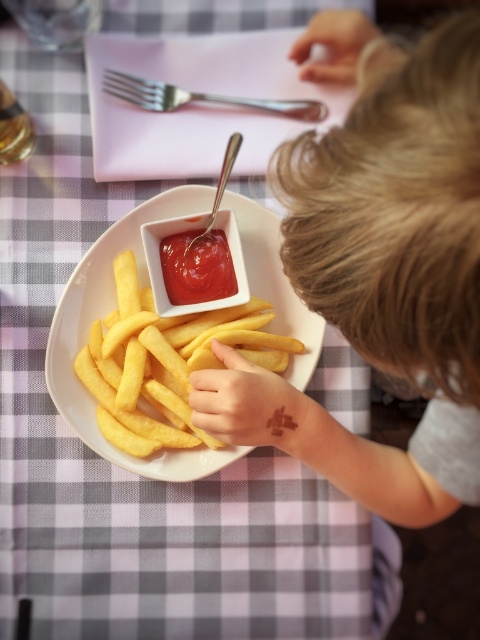
Question: Which point is farther to the camera?

Choices:
 (A) smooth yellow fries at center
 (B) yellow crispy french fries at center
 (C) satin silver fork at upper center

Answer: (C)

Question: Based on their relative distances, which object is nearer to the yellow crispy french fries at center?

Choices:
 (A) satin silver fork at upper center
 (B) shiny red ketchup at center

Answer: (B)

Question: Is smooth yellow fries at center thinner than satin silver fork at upper center?

Choices:
 (A) no
 (B) yes

Answer: (A)

Question: Does shiny red ketchup at center have a greater width compared to satin silver fork at upper center?

Choices:
 (A) no
 (B) yes

Answer: (A)

Question: Which of the following is the closest to the observer?

Choices:
 (A) yellow crispy french fries at center
 (B) smooth yellow fries at center

Answer: (B)

Question: Does shiny red ketchup at center appear over satin silver fork at upper center?

Choices:
 (A) yes
 (B) no

Answer: (B)